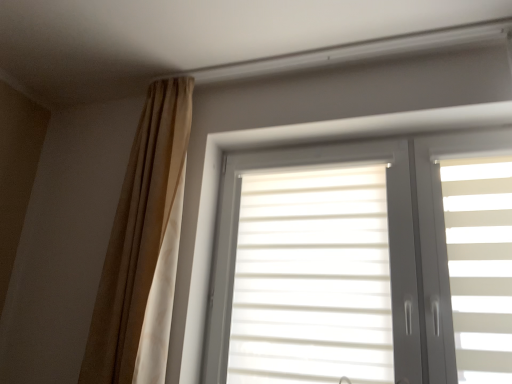
At what (x,y) coordinates should I click in order to perform the action: click on beige fabric curtain at upper left. Please return your answer as a coordinate pair (x, y). The width and height of the screenshot is (512, 384). Looking at the image, I should click on (138, 231).

In order to face beige fabric curtain at upper left, should I rotate leftwards or rightwards?

You should rotate left by 15.187 degrees.

This screenshot has height=384, width=512. Describe the element at coordinates (138, 231) in the screenshot. I see `beige fabric curtain at upper left` at that location.

Where is `white matte window at center`? The image size is (512, 384). white matte window at center is located at coordinates (362, 263).

What do you see at coordinates (362, 263) in the screenshot?
I see `white matte window at center` at bounding box center [362, 263].

The height and width of the screenshot is (384, 512). Find the location of `beige fabric curtain at upper left`. beige fabric curtain at upper left is located at coordinates 138,231.

Looking at this image, is beige fabric curtain at upper left at the right side of white matte window at center?

In fact, beige fabric curtain at upper left is to the left of white matte window at center.

Which object is further away from the camera taking this photo, beige fabric curtain at upper left or white matte window at center?

beige fabric curtain at upper left is behind.

Is point (140, 271) positioned before point (267, 237)?

Yes, point (140, 271) is in front of point (267, 237).

Consider the image. From the image's perspective, is beige fabric curtain at upper left on top of white matte window at center?

Yes, from the image's perspective, beige fabric curtain at upper left is over white matte window at center.

From a real-world perspective, is beige fabric curtain at upper left on white matte window at center?

Yes, from a real-world perspective, beige fabric curtain at upper left is above white matte window at center.

Does beige fabric curtain at upper left have a lesser width compared to white matte window at center?

Incorrect, the width of beige fabric curtain at upper left is not less than that of white matte window at center.

Considering the sizes of objects beige fabric curtain at upper left and white matte window at center in the image provided, who is shorter, beige fabric curtain at upper left or white matte window at center?

With less height is white matte window at center.

Based on the photo, considering the sizes of beige fabric curtain at upper left and white matte window at center in the image, is beige fabric curtain at upper left bigger or smaller than white matte window at center?

beige fabric curtain at upper left is smaller than white matte window at center.

In the scene shown: Is beige fabric curtain at upper left positioned beyond the bounds of white matte window at center?

Yes, beige fabric curtain at upper left is not within white matte window at center.

Would you say beige fabric curtain at upper left is a long distance from white matte window at center?

No, beige fabric curtain at upper left is in close proximity to white matte window at center.

Is beige fabric curtain at upper left facing towards white matte window at center?

No, beige fabric curtain at upper left is not facing towards white matte window at center.

The height and width of the screenshot is (384, 512). What are the coordinates of `curtain that appears above the white matte window at center (from a real-world perspective)` in the screenshot? It's located at (138, 231).

Between white matte window at center and beige fabric curtain at upper left, which one appears on the left side from the viewer's perspective?

From the viewer's perspective, beige fabric curtain at upper left appears more on the left side.

Is the position of white matte window at center less distant than that of beige fabric curtain at upper left?

That is True.

Is point (273, 153) closer to camera compared to point (149, 269)?

No.

From the image's perspective, is white matte window at center located above beige fabric curtain at upper left?

Incorrect, from the image's perspective, white matte window at center is lower than beige fabric curtain at upper left.

From a real-world perspective, is white matte window at center positioned above or below beige fabric curtain at upper left?

In terms of real-world spatial position, white matte window at center is below beige fabric curtain at upper left.

Considering the relative sizes of white matte window at center and beige fabric curtain at upper left in the image provided, is white matte window at center wider than beige fabric curtain at upper left?

No.

Considering the sizes of white matte window at center and beige fabric curtain at upper left in the image, is white matte window at center taller or shorter than beige fabric curtain at upper left?

Considering their sizes, white matte window at center has less height than beige fabric curtain at upper left.

Based on their sizes in the image, would you say white matte window at center is bigger or smaller than beige fabric curtain at upper left?

white matte window at center is bigger than beige fabric curtain at upper left.

Could beige fabric curtain at upper left be considered to be inside white matte window at center?

Actually, beige fabric curtain at upper left is outside white matte window at center.

Can you see white matte window at center touching beige fabric curtain at upper left?

white matte window at center and beige fabric curtain at upper left are clearly separated.

Is white matte window at center turned away from beige fabric curtain at upper left?

white matte window at center does not have its back to beige fabric curtain at upper left.

Identify the location of window below the beige fabric curtain at upper left (from the image's perspective). (362, 263).

This screenshot has height=384, width=512. Identify the location of window lying on the right of beige fabric curtain at upper left. (362, 263).

The height and width of the screenshot is (384, 512). What are the coordinates of `window below the beige fabric curtain at upper left (from a real-world perspective)` in the screenshot? It's located at (362, 263).